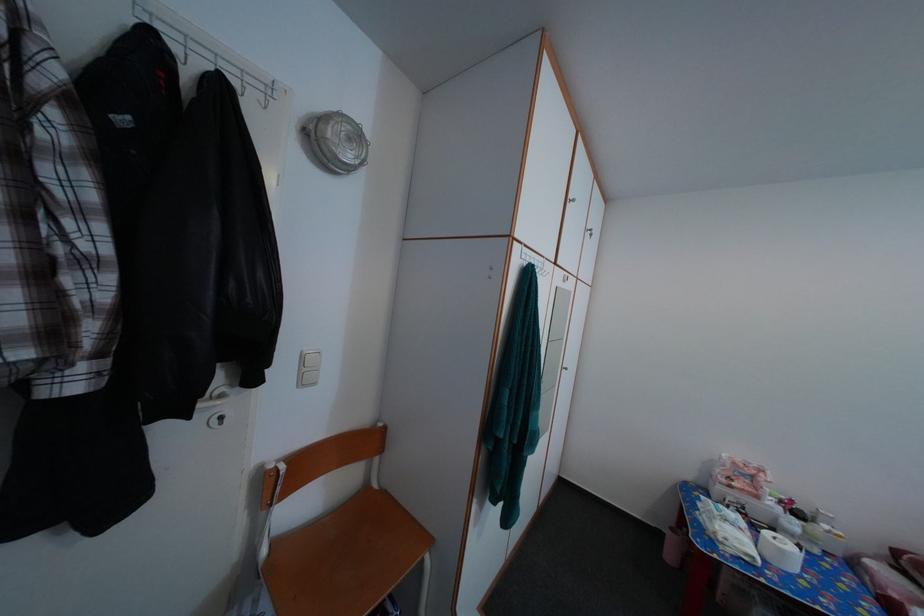
The width and height of the screenshot is (924, 616). Find the location of `metal towel hook`. metal towel hook is located at coordinates (537, 264).